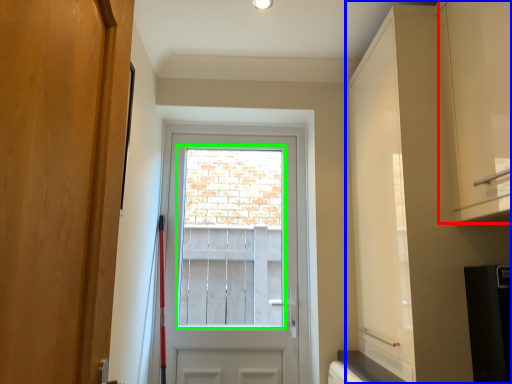
Question: Based on their relative distances, which object is farther from cabinetry (highlighted by a red box)? Choose from dresser (highlighted by a blue box) and window screen (highlighted by a green box).

Choices:
 (A) dresser
 (B) window screen

Answer: (B)